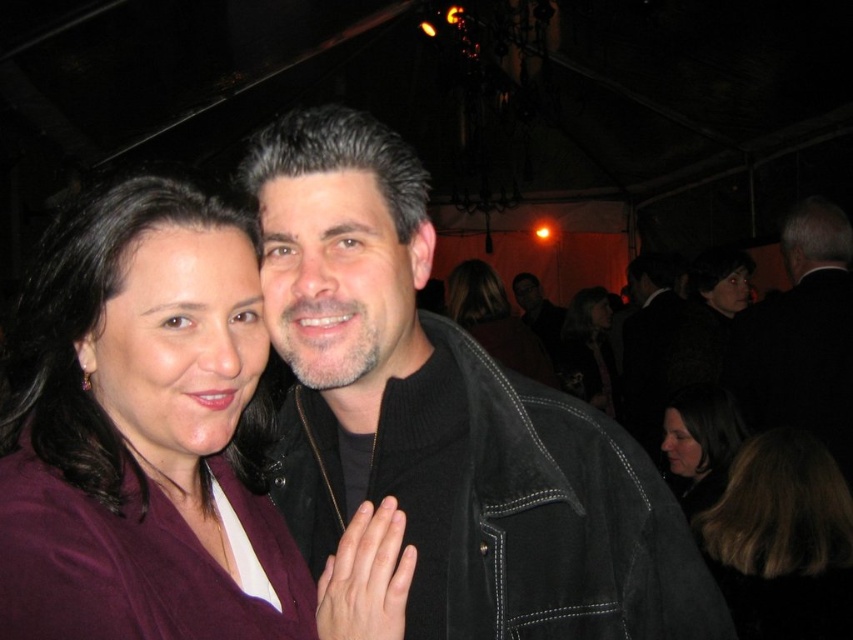
Consider the image. You are standing in the middle of the room and want to reach both the point at coordinates point (381,264) and the point at coordinates point (822,307). Which point should you reach first based on their positions?

You should reach point (381,264) first because it is closer to you than point (822,307).

You are at a party and want to take a photo of the suede jacket at center and the smooth black dress at center. Since you can only focus on one object at a time, which one should you aim the camera at first to ensure the other is still in the frame?

You should aim the camera at the suede jacket at center first because it is positioned to the left of the smooth black dress at center, so if you focus on the leftmost object, the right side will naturally stay in the frame as well.